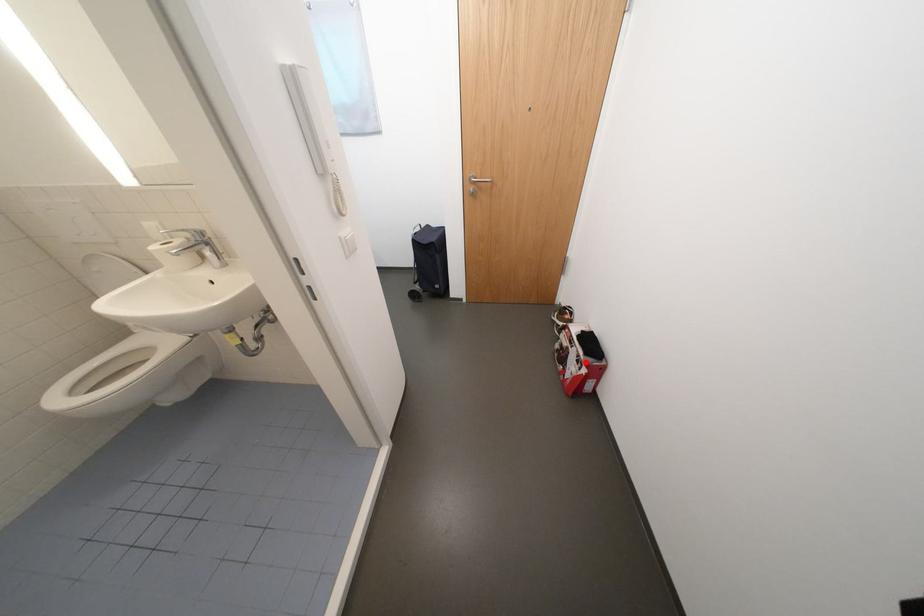
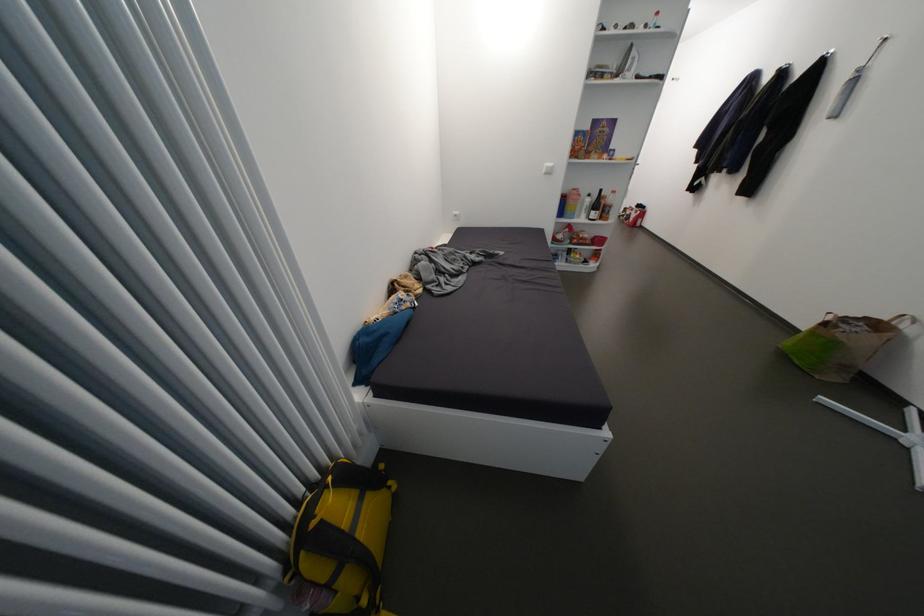
Question: A red point is marked in image1. In image2, is the corresponding 3D point closer to the camera or farther? Reply with the corresponding letter.

Choices:
 (A) The corresponding 3D point is closer.
 (B) The corresponding 3D point is farther.

Answer: (B)